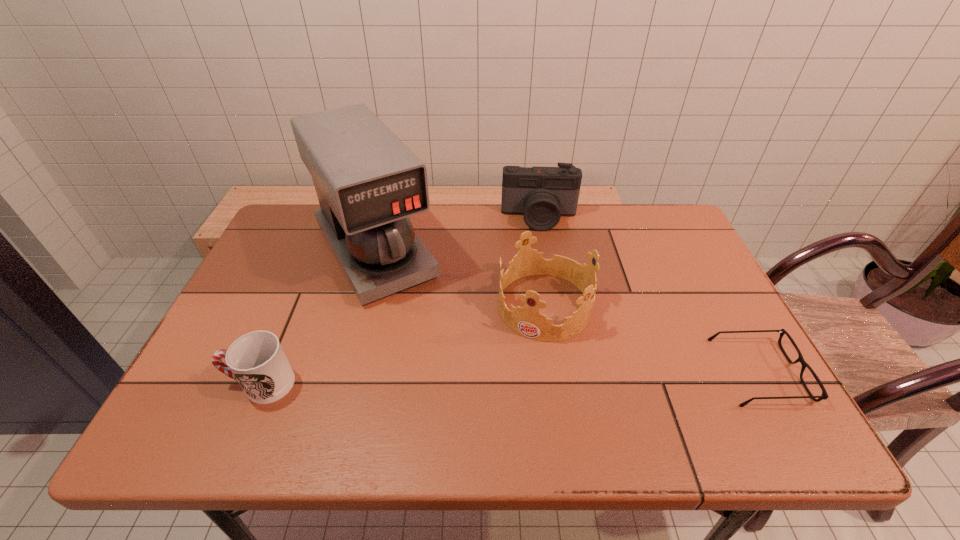
You are a GUI agent. You are given a task and a screenshot of the screen. Output one action in this format:
    pyautogui.click(x=<x>, y=<y>)
    Task: Click on the second shortest object
    This screenshot has height=540, width=960.
    Given the screenshot: What is the action you would take?
    pyautogui.click(x=256, y=360)

Find the location of a particular element. spectacles is located at coordinates (824, 396).

Find the location of a particular element. The height and width of the screenshot is (540, 960). the shortest object is located at coordinates (824, 396).

Find the location of `tiara`. tiara is located at coordinates (527, 321).

Image resolution: width=960 pixels, height=540 pixels. What are the coordinates of `the tallest object` in the screenshot? It's located at (368, 182).

Identify the location of camera. (542, 195).

Find the location of a particular element. Image resolution: width=960 pixels, height=540 pixels. vacant space located on the front-facing side of the tiara is located at coordinates [x=499, y=399].

The height and width of the screenshot is (540, 960). Identify the location of vacant area situated on the carafe side of the coffee maker. (444, 369).

The width and height of the screenshot is (960, 540). I want to click on vacant space located 0.070m on the carafe side of the coffee maker, so click(x=412, y=318).

At what (x,y) coordinates should I click in order to perform the action: click on vacant space located 0.280m on the carafe side of the coffee maker. Please return your answer as a coordinate pair (x, y). Looking at the image, I should click on (450, 379).